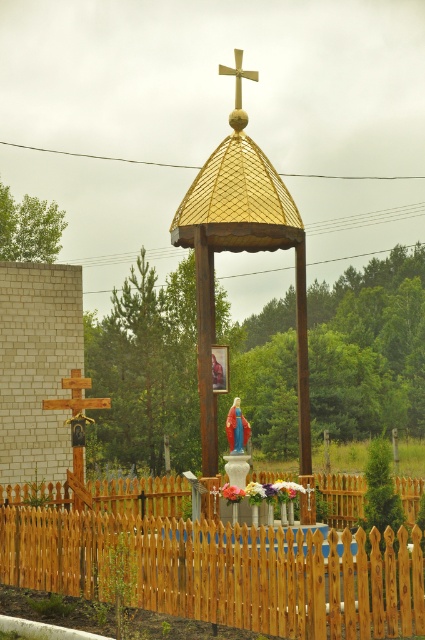
You are a visitor at the religious site and want to take a photo of the gold textured dome at center without the wooden picket fence at center blocking the view. Is it possible to do so by standing far enough back?

The wooden picket fence at center is not as tall as the gold textured dome at center, so if you stand far enough back, the fence will appear smaller in the frame, allowing the dome to be visible without obstruction.

You are a visitor at this religious site and want to take a photo of the gold textured dome at center and the matte blue statue at center. Since the dome is blocking the statue, how should you position yourself to capture both in the frame?

The gold textured dome at center is positioned over the matte blue statue at center. To capture both in the frame, you should position yourself at an angle where the dome is partially visible above the statue, ensuring both are in the shot without one fully obscuring the other.